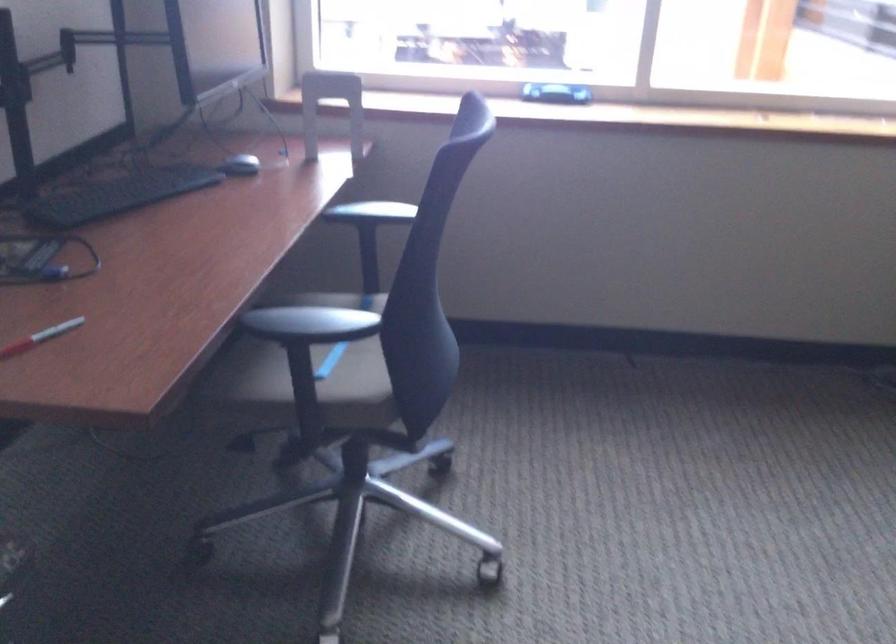
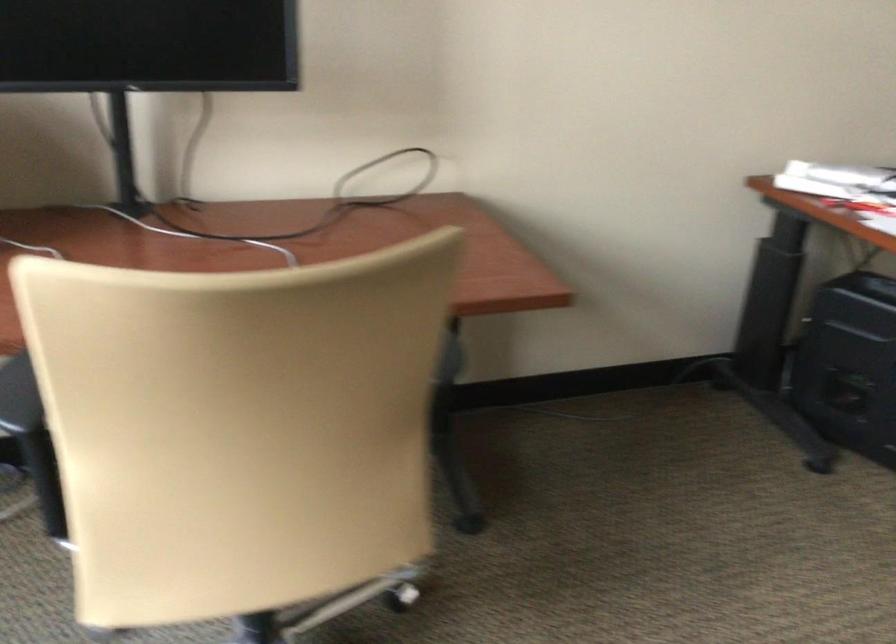
The images are taken continuously from a first-person perspective. In which direction is your viewpoint rotating?

The camera's rotation is toward right-down.